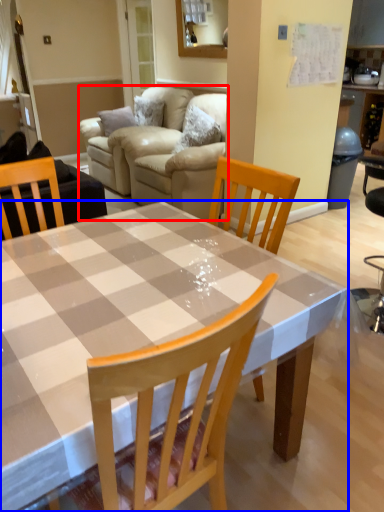
Question: Which of the following is the closest to the observer, studio couch (highlighted by a red box) or kitchen & dining room table (highlighted by a blue box)?

Choices:
 (A) studio couch
 (B) kitchen & dining room table

Answer: (B)